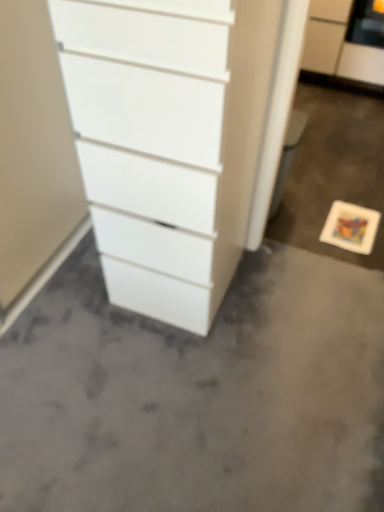
Question: Relative to white glossy chest of drawers at center, is gray matte concrete at center in front or behind?

Choices:
 (A) front
 (B) behind

Answer: (B)

Question: Would you say gray matte concrete at center is inside or outside white glossy chest of drawers at center?

Choices:
 (A) inside
 (B) outside

Answer: (B)

Question: Which of these objects is positioned farthest from the gray matte concrete at center?

Choices:
 (A) white glossy chest of drawers at center
 (B) white matte filing cabinet at upper right

Answer: (B)

Question: Which object is positioned closest to the white glossy chest of drawers at center?

Choices:
 (A) gray matte concrete at center
 (B) white matte filing cabinet at upper right

Answer: (A)